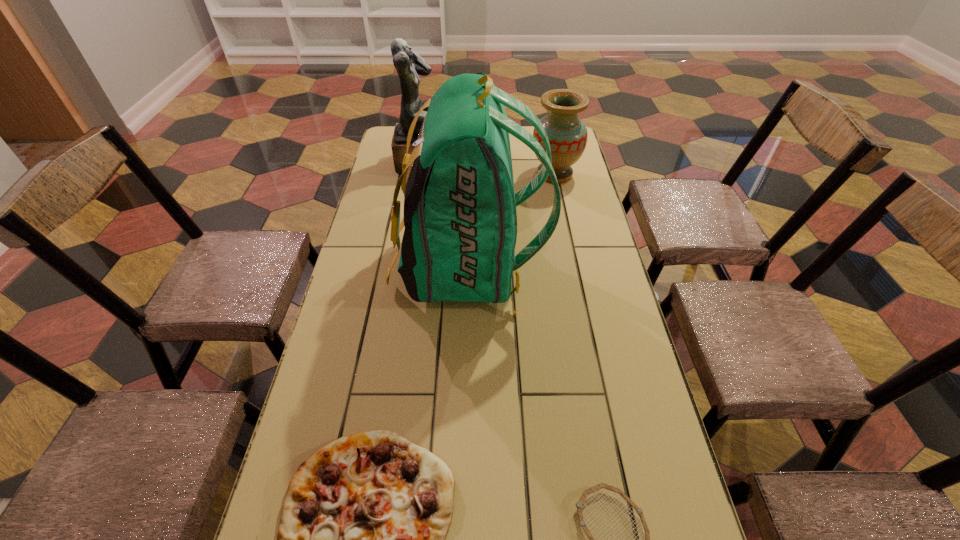
Where is `object positioned at the right edge`? The width and height of the screenshot is (960, 540). object positioned at the right edge is located at coordinates (567, 134).

Where is `object that is at the far left corner`? This screenshot has height=540, width=960. object that is at the far left corner is located at coordinates (409, 65).

Find the location of a particular element. free space at the far edge of the desktop is located at coordinates (514, 148).

In the image, there is a desktop. At what (x,y) coordinates should I click in order to perform the action: click on vacant area at the left edge. Please return your answer as a coordinate pair (x, y). This screenshot has width=960, height=540. Looking at the image, I should click on (349, 326).

In the image, there is a desktop. Where is `blank space at the right edge`? blank space at the right edge is located at coordinates (607, 278).

Identify which object is the closest to the second tallest object. Please provide its 2D coordinates. Your answer should be formatted as a tuple, i.e. [(x, y)], where the tuple contains the x and y coordinates of a point satisfying the conditions above.

[(460, 218)]

Locate an element on the screen. This screenshot has height=540, width=960. object that is the third closest to the second shortest object is located at coordinates tap(567, 134).

The height and width of the screenshot is (540, 960). Identify the location of free space that satisfies the following two spatial constraints: 1. in a relaxed pose on the third tallest object; 2. on the right side of the sculpture. (425, 174).

Locate an element on the screen. The image size is (960, 540). free space that satisfies the following two spatial constraints: 1. in a relaxed pose on the sculpture; 2. on the left side of the third shortest object is located at coordinates (425, 174).

Image resolution: width=960 pixels, height=540 pixels. In order to click on vacant region that satisfies the following two spatial constraints: 1. in a relaxed pose on the vase; 2. on the right side of the fourth shortest object in this screenshot , I will do `click(425, 174)`.